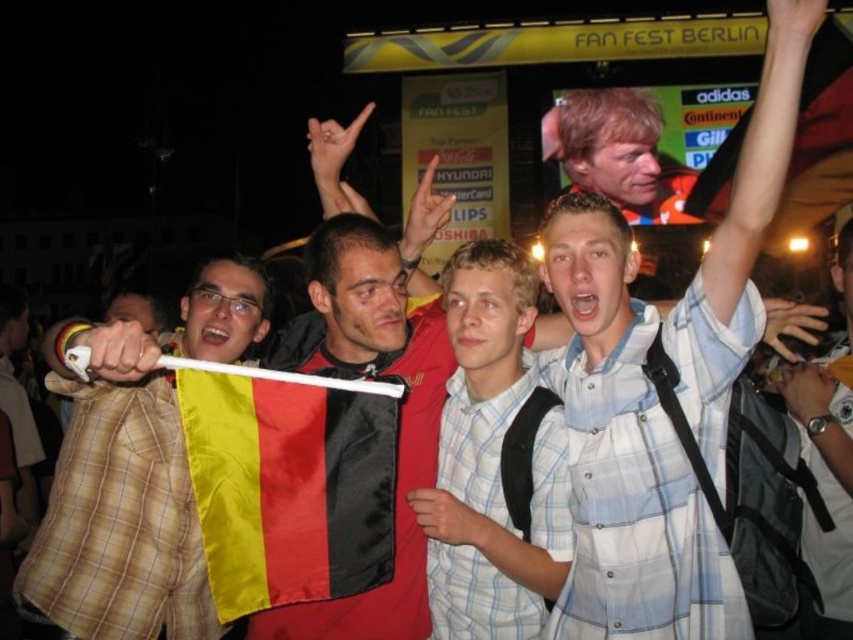
Question: Which point is closer to the camera?

Choices:
 (A) (172, 624)
 (B) (474, 266)
 (C) (244, 449)

Answer: (C)

Question: Which point is closer to the camera?

Choices:
 (A) (459, 428)
 (B) (167, 397)
 (C) (666, 179)
 (D) (267, 596)

Answer: (D)

Question: Which of these objects is positioned closest to the light blue plaid shirt at center?

Choices:
 (A) satin flag at center
 (B) smooth orange shirt at upper center

Answer: (A)

Question: Is satin flag at center bigger than smooth orange shirt at upper center?

Choices:
 (A) no
 (B) yes

Answer: (A)

Question: Can you confirm if plaid shirt at left is bigger than light blue plaid shirt at center?

Choices:
 (A) yes
 (B) no

Answer: (A)

Question: Can you confirm if satin flag at center is positioned above light blue plaid shirt at center?

Choices:
 (A) yes
 (B) no

Answer: (B)